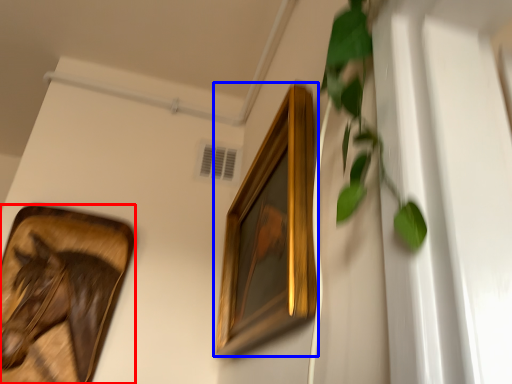
Question: Among these objects, which one is farthest to the camera, picture frame (highlighted by a red box) or picture frame (highlighted by a blue box)?

Choices:
 (A) picture frame
 (B) picture frame

Answer: (A)